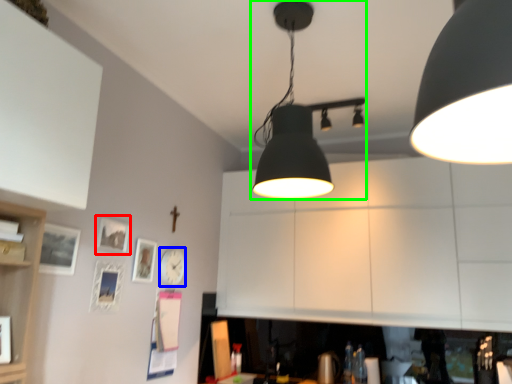
Question: Which is nearer to the picture frame (highlighted by a red box)? clock (highlighted by a blue box) or lamp (highlighted by a green box).

Choices:
 (A) clock
 (B) lamp

Answer: (A)